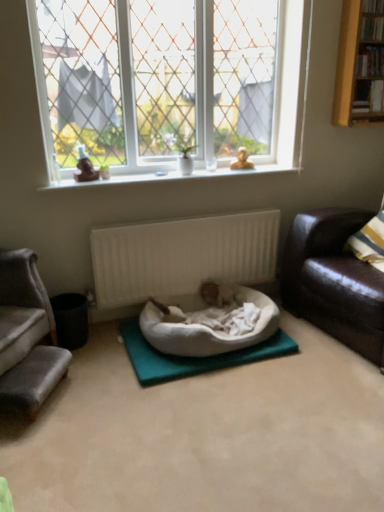
Question: Does velvet grey couch at left, which is the second studio couch from right to left, lie behind black matte trash bin at lower left?

Choices:
 (A) no
 (B) yes

Answer: (A)

Question: Is velvet grey couch at left, which is the first studio couch from left to right, looking in the opposite direction of black matte trash bin at lower left?

Choices:
 (A) no
 (B) yes

Answer: (A)

Question: Can you confirm if velvet grey couch at left, which is the first studio couch from left to right, is shorter than black matte trash bin at lower left?

Choices:
 (A) no
 (B) yes

Answer: (A)

Question: Is velvet grey couch at left, which is the first studio couch from left to right, positioned beyond the bounds of black matte trash bin at lower left?

Choices:
 (A) yes
 (B) no

Answer: (A)

Question: Is velvet grey couch at left, which is the second studio couch from right to left, positioned before black matte trash bin at lower left?

Choices:
 (A) yes
 (B) no

Answer: (A)

Question: From the image's perspective, does velvet grey couch at left, which is the first studio couch from left to right, appear higher than black matte trash bin at lower left?

Choices:
 (A) yes
 (B) no

Answer: (A)

Question: Is white fabric yoga mat at center far away from white ceramic vase at upper center?

Choices:
 (A) no
 (B) yes

Answer: (B)

Question: Considering the relative positions of white fabric yoga mat at center and white ceramic vase at upper center in the image provided, is white fabric yoga mat at center to the right of white ceramic vase at upper center from the viewer's perspective?

Choices:
 (A) yes
 (B) no

Answer: (A)

Question: Is white fabric yoga mat at center not within white ceramic vase at upper center?

Choices:
 (A) no
 (B) yes

Answer: (B)

Question: Is white fabric yoga mat at center looking in the opposite direction of white ceramic vase at upper center?

Choices:
 (A) yes
 (B) no

Answer: (B)

Question: Is white fabric yoga mat at center to the left of white ceramic vase at upper center from the viewer's perspective?

Choices:
 (A) yes
 (B) no

Answer: (B)

Question: From a real-world perspective, is white fabric yoga mat at center positioned under white ceramic vase at upper center based on gravity?

Choices:
 (A) yes
 (B) no

Answer: (A)

Question: Is velvet grey couch at left, which is the first studio couch from left to right, completely or partially inside black matte trash bin at lower left?

Choices:
 (A) yes
 (B) no

Answer: (B)